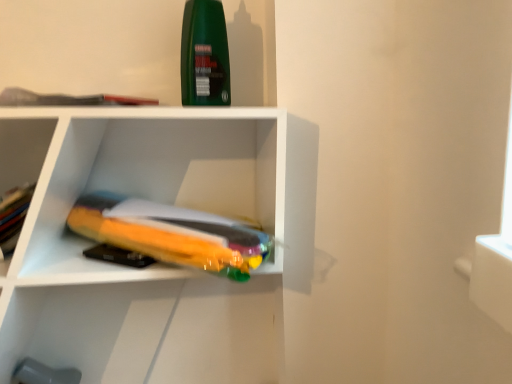
Question: Would you say green matte bottle at upper center is to the left or to the right of translucent orange book at center, marked as the first book in a bottom-to-top arrangement, in the picture?

Choices:
 (A) right
 (B) left

Answer: (A)

Question: From a real-world perspective, relative to translucent orange book at center, marked as the first book in a bottom-to-top arrangement, is green matte bottle at upper center vertically above or below?

Choices:
 (A) above
 (B) below

Answer: (A)

Question: Which of these objects is positioned farthest from the green matte bottle at upper center?

Choices:
 (A) matte gray book at upper left, which is the 2th book in bottom-to-top order
 (B) translucent plastic bag at center
 (C) translucent orange book at center, which appears as the second book when viewed from the top

Answer: (B)

Question: Which object is the closest to the matte gray book at upper left, which is the 2th book in bottom-to-top order?

Choices:
 (A) translucent plastic bag at center
 (B) green matte bottle at upper center
 (C) translucent orange book at center, marked as the first book in a bottom-to-top arrangement

Answer: (A)